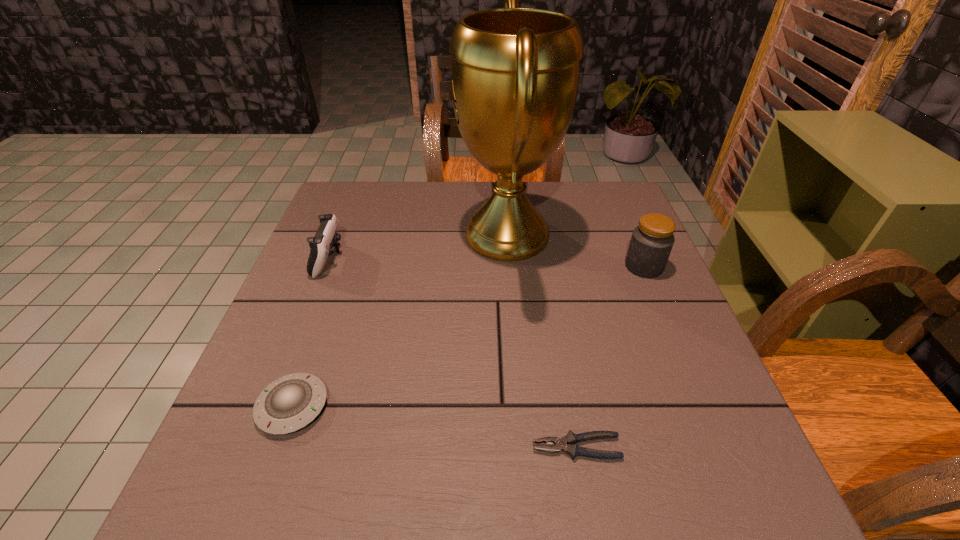
At what (x,y) coordinates should I click in order to perform the action: click on vacant space that satisfies the following two spatial constraints: 1. on the surface of the tallest object with symbols; 2. on the front side of the saucer. Please return your answer as a coordinate pair (x, y). Looking at the image, I should click on (520, 407).

The width and height of the screenshot is (960, 540). I want to click on blank space that satisfies the following two spatial constraints: 1. on the front-facing side of the third tallest object; 2. on the back side of the second shortest object, so click(x=271, y=407).